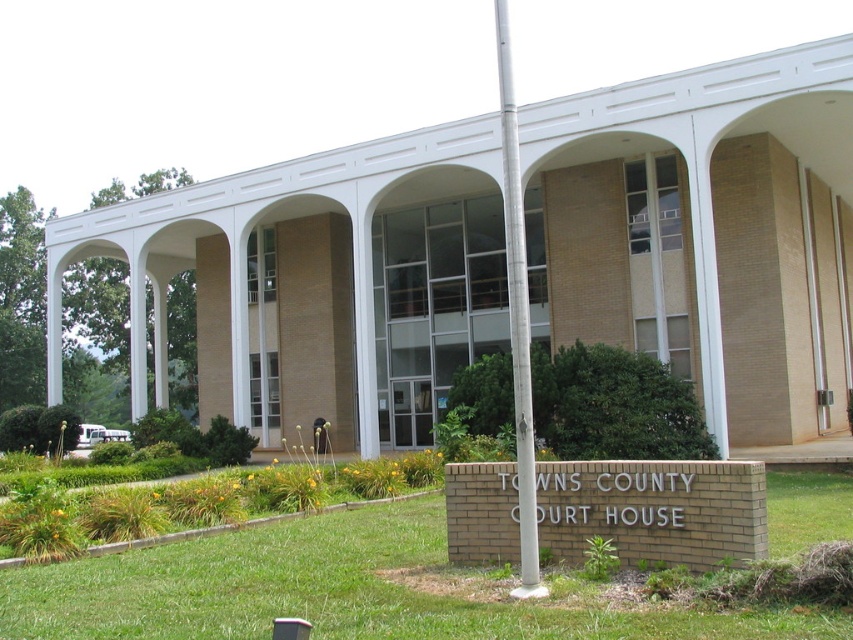
Can you confirm if green grass at lower center is thinner than silver metallic flag pole at center?

No.

Which is behind, point (223, 589) or point (534, 560)?

Positioned behind is point (223, 589).

You are a GUI agent. You are given a task and a screenshot of the screen. Output one action in this format:
    pyautogui.click(x=<x>, y=<y>)
    Task: Click on the green grass at lower center
    
    Given the screenshot: What is the action you would take?
    pyautogui.click(x=337, y=592)